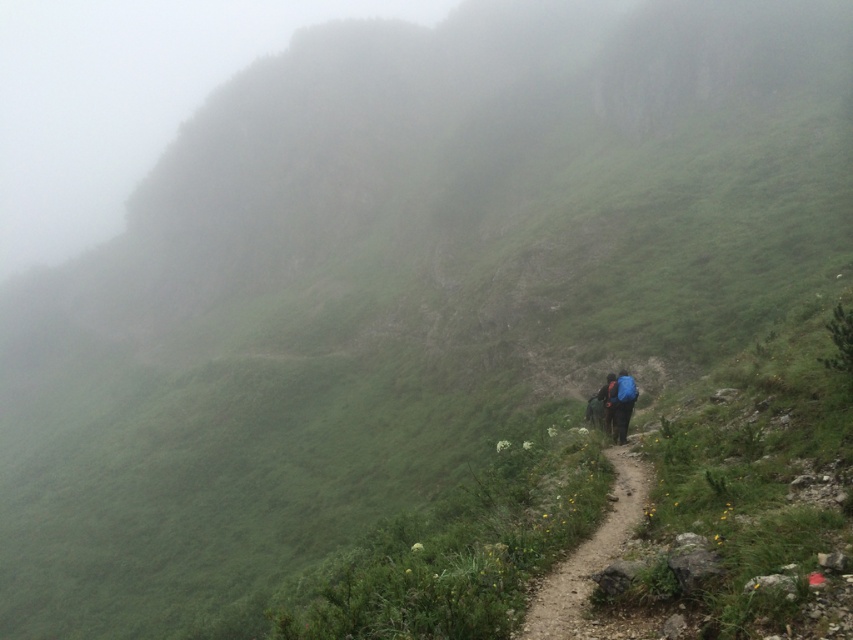
Question: Is dirt path at center behind blue fabric backpack at lower center?

Choices:
 (A) yes
 (B) no

Answer: (B)

Question: Is blue fabric backpack at lower center further to the viewer compared to orange fabric backpack at center?

Choices:
 (A) yes
 (B) no

Answer: (B)

Question: In this image, where is blue fabric backpack at lower center located relative to orange fabric backpack at center?

Choices:
 (A) left
 (B) right

Answer: (B)

Question: Which object is positioned closest to the dirt path at center?

Choices:
 (A) orange fabric backpack at center
 (B) blue fabric backpack at lower center

Answer: (B)

Question: Which point appears closest to the camera in this image?

Choices:
 (A) (601, 388)
 (B) (541, 616)
 (C) (625, 435)

Answer: (B)

Question: Considering the real-world distances, which object is farthest from the orange fabric backpack at center?

Choices:
 (A) blue fabric backpack at lower center
 (B) dirt path at center

Answer: (B)